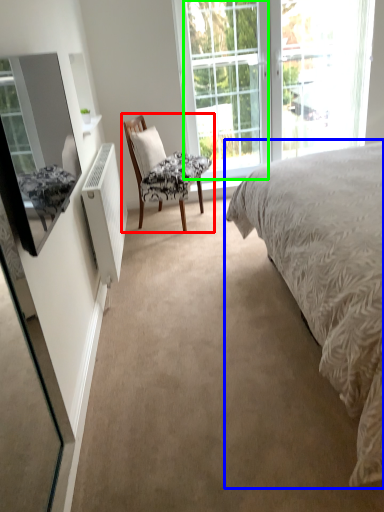
Question: Which object is the farthest from chair (highlighted by a red box)? Choose among these: bed (highlighted by a blue box) or glass door (highlighted by a green box).

Choices:
 (A) bed
 (B) glass door

Answer: (A)